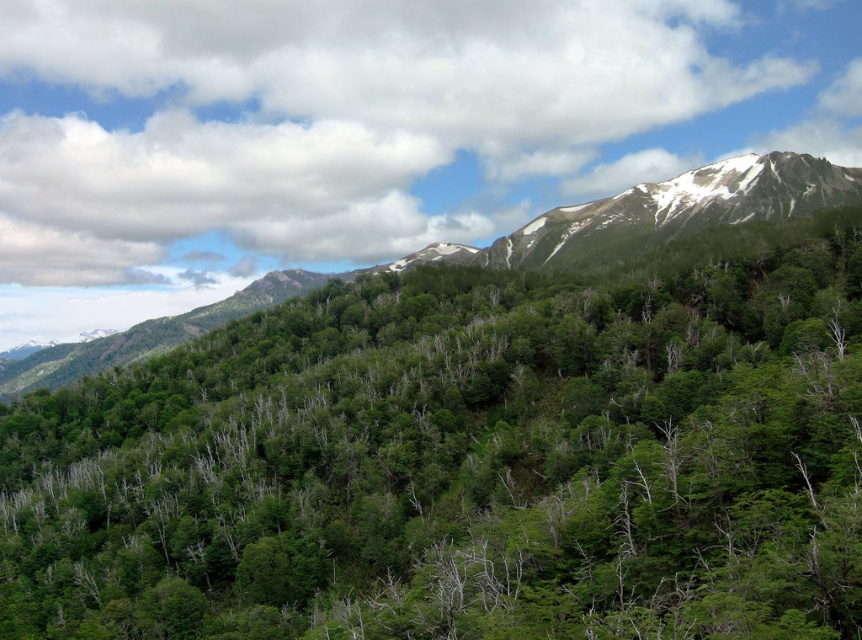
In the scene shown: Does green leafy tree at center have a greater height compared to green leafy forest at upper center?

No, green leafy tree at center is not taller than green leafy forest at upper center.

Is green leafy tree at center below green leafy forest at upper center?

Yes, green leafy tree at center is below green leafy forest at upper center.

Which is behind, point (155, 388) or point (503, 248)?

The point (503, 248) is behind.

Locate an element on the screen. green leafy tree at center is located at coordinates (467, 460).